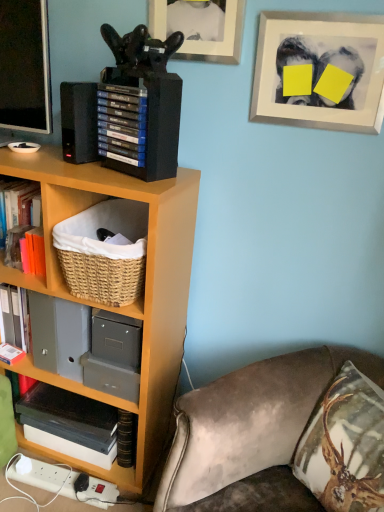
Question: In terms of size, does white matte picture frame at upper right, the 1th picture frame viewed from the right, appear bigger or smaller than black glossy speaker at upper left?

Choices:
 (A) small
 (B) big

Answer: (A)

Question: From the image's perspective, relative to black glossy speaker at upper left, is white matte picture frame at upper right, which is counted as the 2th picture frame, starting from the left, above or below?

Choices:
 (A) below
 (B) above

Answer: (A)

Question: Estimate the real-world distances between objects in this image. Which object is closer to the blue matte game cases at upper left?

Choices:
 (A) black matte book at lower left
 (B) black glossy speaker at upper left
 (C) matte black picture frame at upper center, the second picture frame positioned from the right
 (D) white matte picture frame at upper right, which is counted as the 2th picture frame, starting from the left
 (E) velvet brown pillow with deer print at lower right

Answer: (B)

Question: Estimate the real-world distances between objects in this image. Which object is closer to the matte black picture frame at upper center, the second picture frame positioned from the right?

Choices:
 (A) velvet brown pillow with deer print at lower right
 (B) woven natural basket at lower left
 (C) blue matte game cases at upper left
 (D) velvet brown couch at lower right
 (E) black plastic speaker at upper left

Answer: (C)